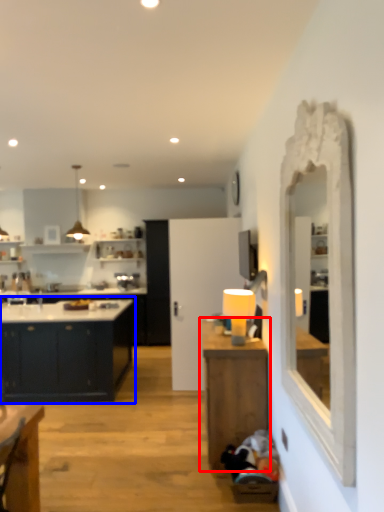
Question: Which point is closer to the camera, table (highlighted by a red box) or cabinetry (highlighted by a blue box)?

Choices:
 (A) table
 (B) cabinetry

Answer: (A)